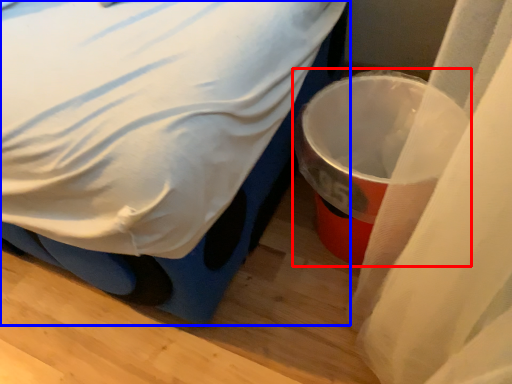
Question: Which object appears farthest to the camera in this image, waste container (highlighted by a red box) or bed (highlighted by a blue box)?

Choices:
 (A) waste container
 (B) bed

Answer: (A)